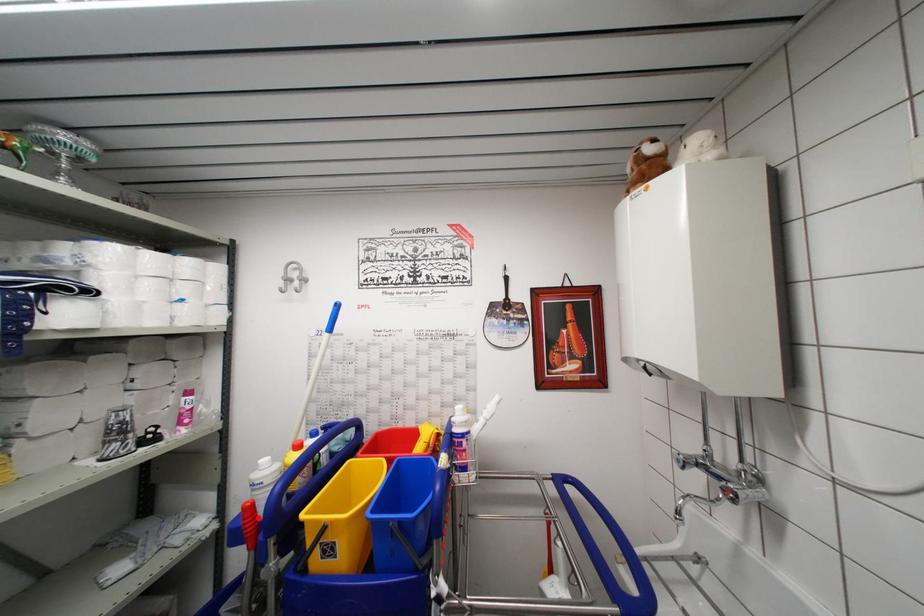
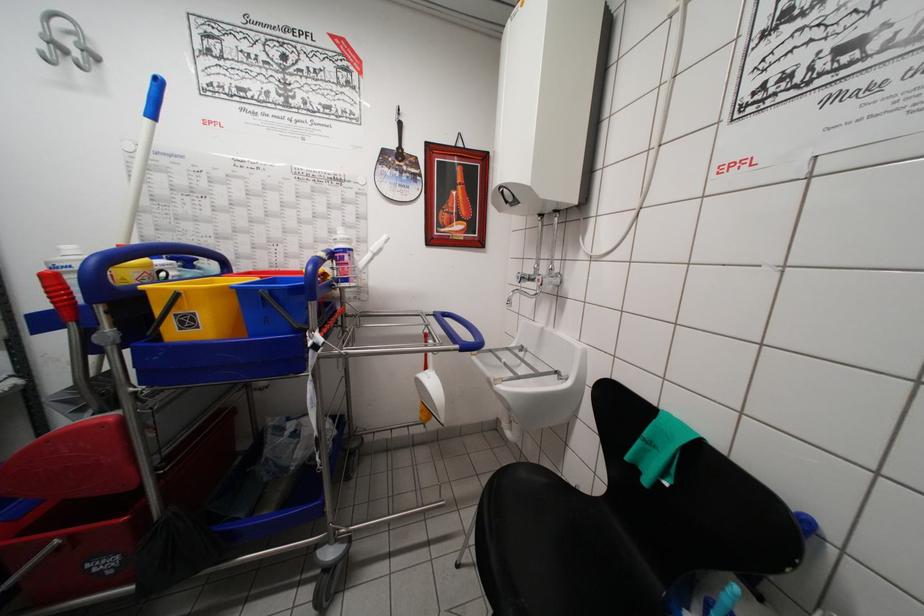
In the second image, find the point that corresponds to the highlighted location in the first image.

(67, 289)